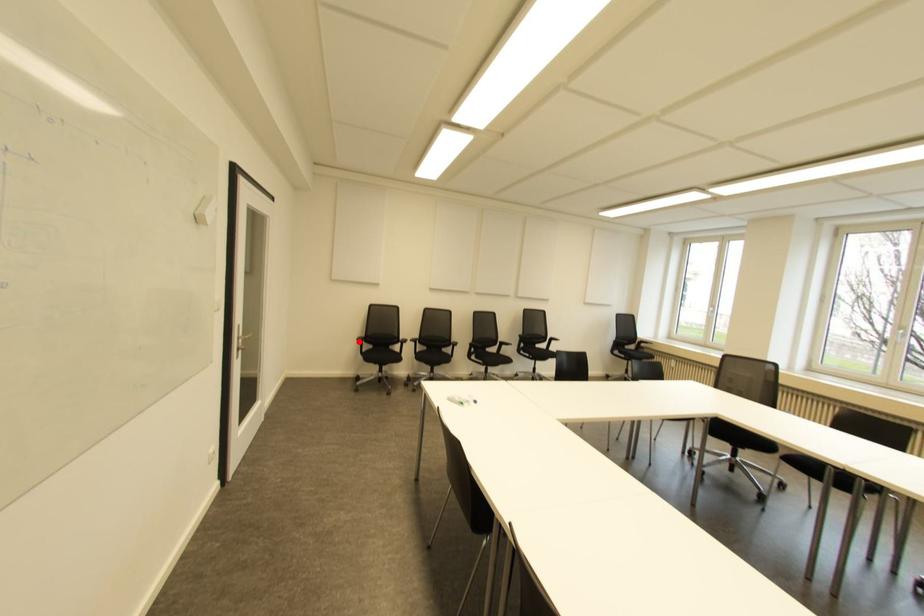
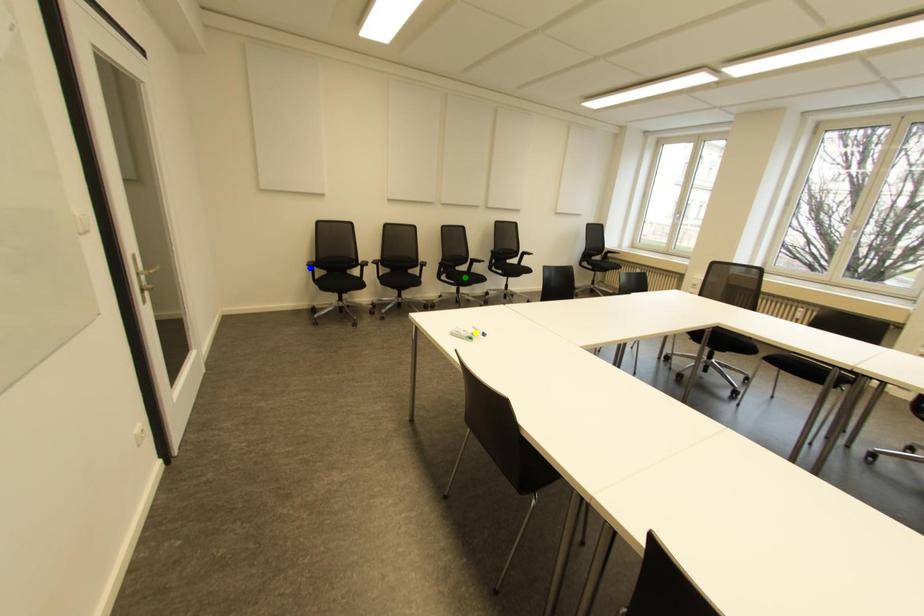
Question: I am providing you with two images of the same scene from different viewpoints. A red point is marked on the first image. You are given multiple points on the second image. Which point in image 2 represents the same 3d spot as the red point in image 1?

Choices:
 (A) green point
 (B) yellow point
 (C) blue point

Answer: (C)